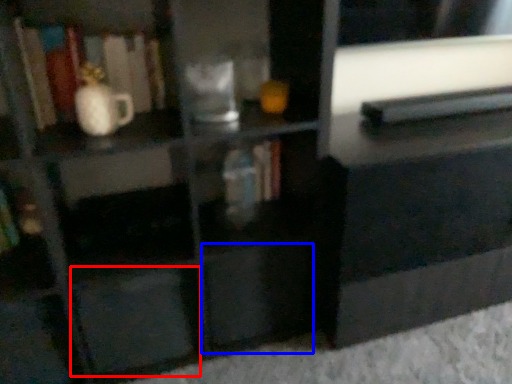
Question: Which of the following is the closest to the observer, drawer (highlighted by a red box) or drawer (highlighted by a blue box)?

Choices:
 (A) drawer
 (B) drawer

Answer: (A)